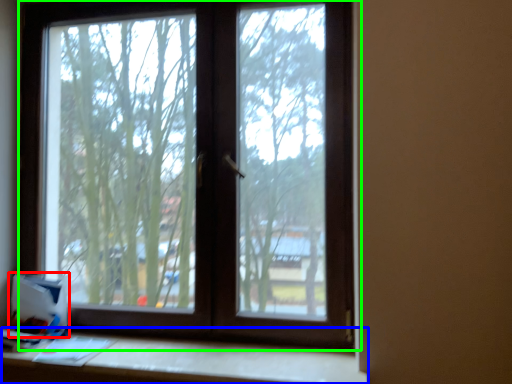
Question: Which is farther away from cardboard box (highlighted by a red box)? table (highlighted by a blue box) or window (highlighted by a green box)?

Choices:
 (A) table
 (B) window

Answer: (B)